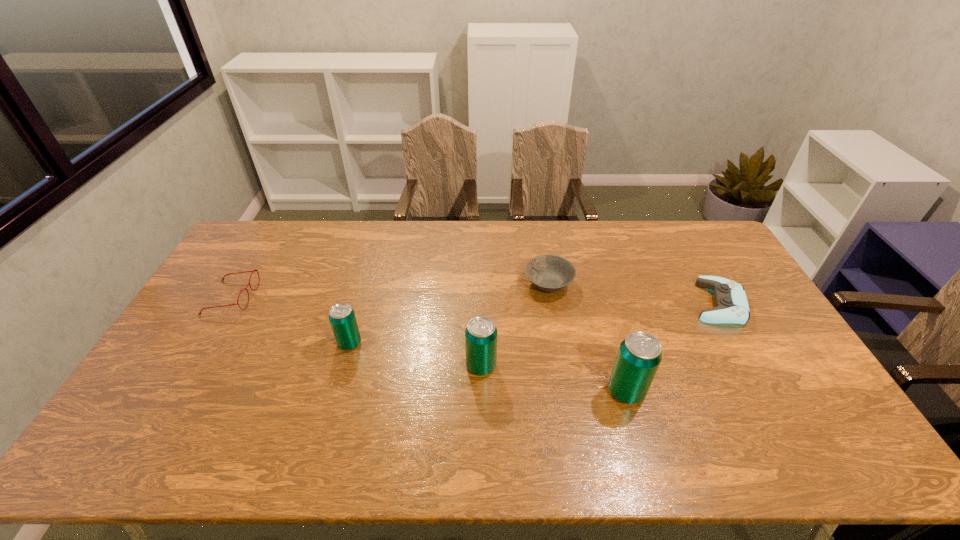
In order to click on the third nearest object in this screenshot , I will do [342, 317].

Identify the location of the farthest beer can. The width and height of the screenshot is (960, 540). (342, 317).

I want to click on the second beer can from right to left, so click(x=481, y=333).

Where is `the fourth object from right to left`? the fourth object from right to left is located at coordinates (481, 333).

The width and height of the screenshot is (960, 540). I want to click on the second object from right to left, so click(x=639, y=355).

The width and height of the screenshot is (960, 540). In order to click on spectacles in this screenshot , I will do `click(252, 271)`.

This screenshot has height=540, width=960. I want to click on the third object from right to left, so click(549, 273).

In order to click on the rightmost object in this screenshot , I will do `click(731, 302)`.

You are a GUI agent. You are given a task and a screenshot of the screen. Output one action in this format:
    pyautogui.click(x=<x>, y=<y>)
    Task: Click on the vacant space located 0.290m on the right of the farthest beer can
    
    Given the screenshot: What is the action you would take?
    pyautogui.click(x=461, y=343)

Find the location of `free location located 0.060m on the front of the second beer can from left to right`. free location located 0.060m on the front of the second beer can from left to right is located at coordinates (481, 397).